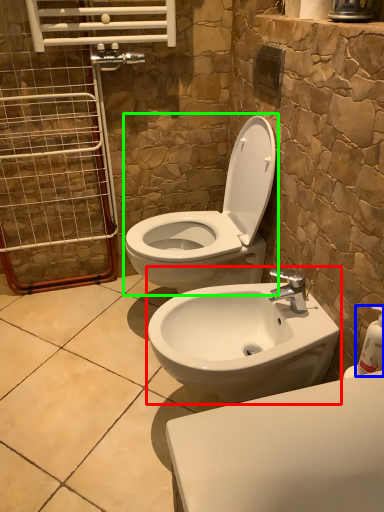
Question: Which object is the farthest from sink (highlighted by a red box)? Choose among these: soap dispenser (highlighted by a blue box) or toilet (highlighted by a green box).

Choices:
 (A) soap dispenser
 (B) toilet

Answer: (A)